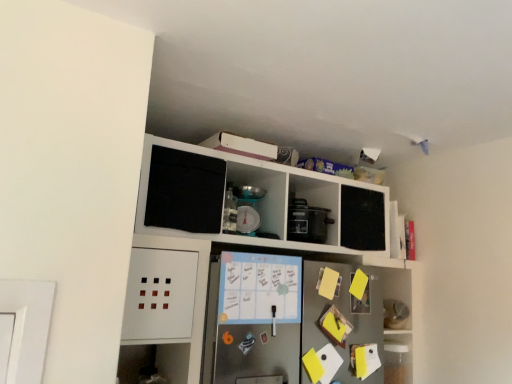
Question: Is matte black rice cooker at center to the left or to the right of metallic scale at upper center in the image?

Choices:
 (A) right
 (B) left

Answer: (A)

Question: From a real-world perspective, relative to metallic scale at upper center, is matte black rice cooker at center vertically above or below?

Choices:
 (A) below
 (B) above

Answer: (A)

Question: Estimate the real-world distances between objects in this image. Which object is closer to the white matte cabinet at upper center?

Choices:
 (A) matte black rice cooker at center
 (B) metallic scale at upper center

Answer: (B)

Question: Based on their relative distances, which object is farther from the matte black rice cooker at center?

Choices:
 (A) white matte cabinet at upper center
 (B) metallic scale at upper center

Answer: (A)